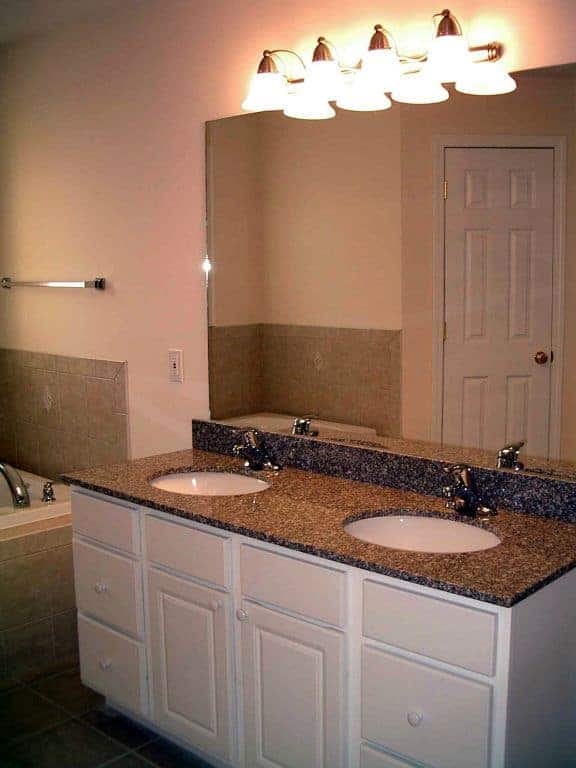
You are a GUI agent. You are given a task and a screenshot of the screen. Output one action in this format:
    pyautogui.click(x=<x>, y=<y>)
    Task: Click on the sink 2
    The width and height of the screenshot is (576, 768).
    Given the screenshot: What is the action you would take?
    pyautogui.click(x=214, y=481)